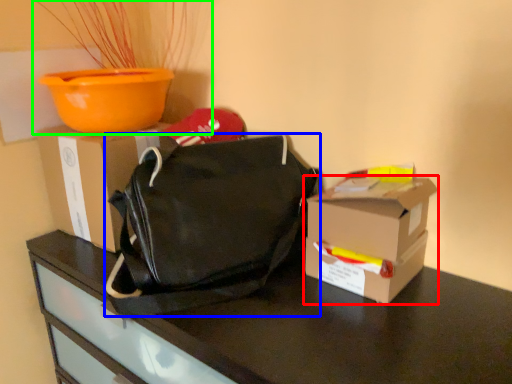
Question: Estimate the real-world distances between objects in this image. Which object is closer to box (highlighted by a red box), handbag (highlighted by a blue box) or houseplant (highlighted by a green box)?

Choices:
 (A) handbag
 (B) houseplant

Answer: (A)